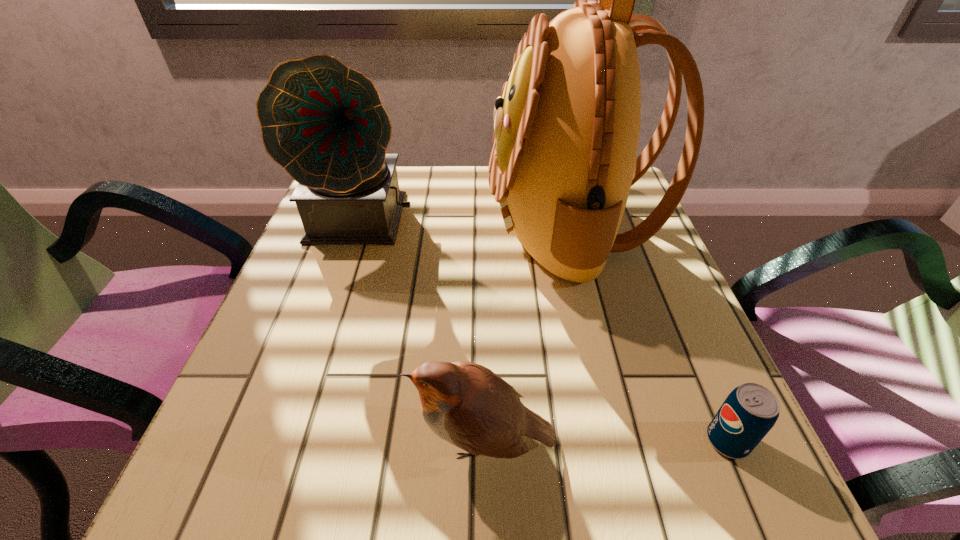
Identify the location of vacant space that satisfies the following two spatial constraints: 1. on the front-facing side of the backpack; 2. on the right side of the shortest object. (623, 441).

The image size is (960, 540). In order to click on free spot that satisfies the following two spatial constraints: 1. on the horn of the pop; 2. on the right side of the leftmost object in this screenshot , I will do `click(291, 441)`.

What are the coordinates of `free location that satisfies the following two spatial constraints: 1. on the back side of the pop; 2. on the front-facing side of the backpack` in the screenshot? It's located at (636, 226).